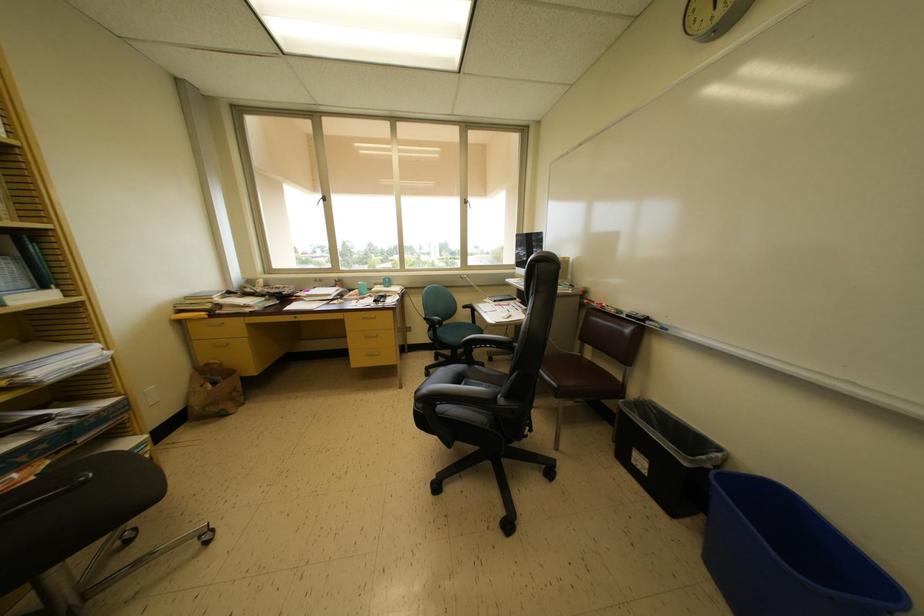
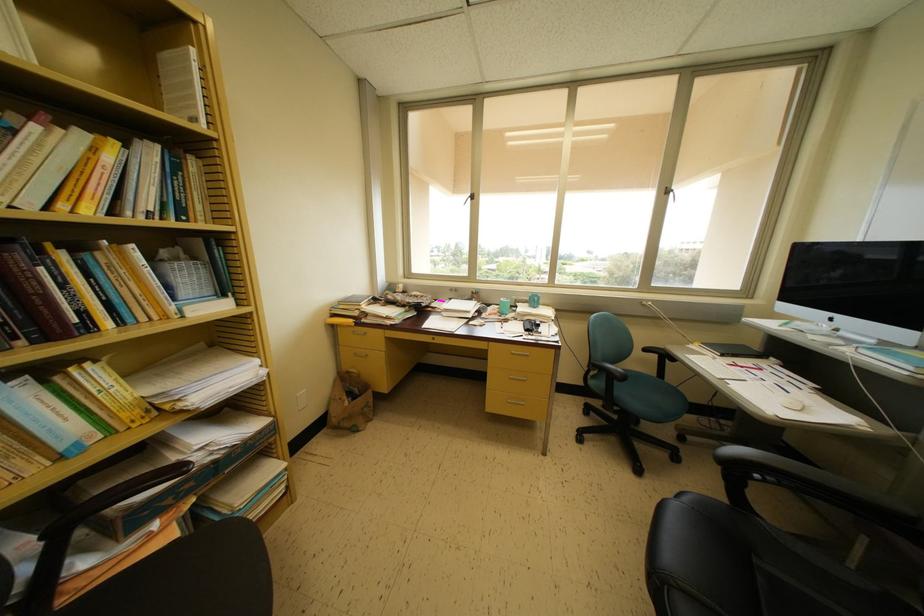
Where in the second image is the point corresponding to (440,326) from the first image?

(622, 379)